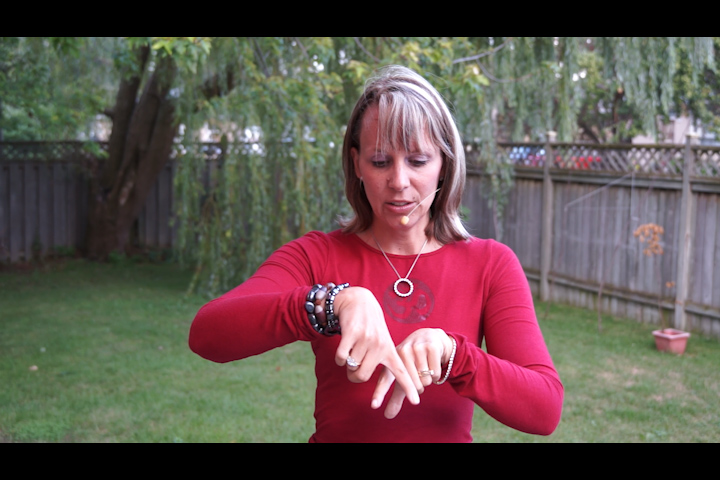
Locate an element on the screen. planter is located at coordinates (678, 343).